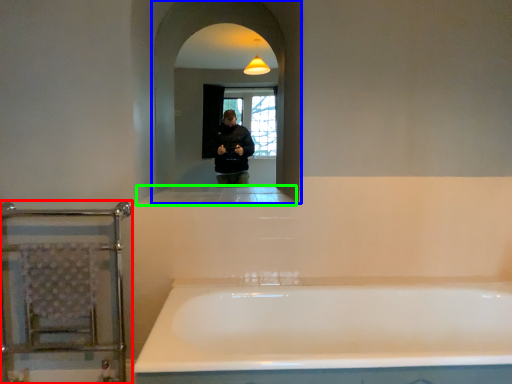
Question: Which object is positioned closest to balustrade (highlighted by a red box)? Select from mirror (highlighted by a blue box) and ledge (highlighted by a green box).

Choices:
 (A) mirror
 (B) ledge

Answer: (B)